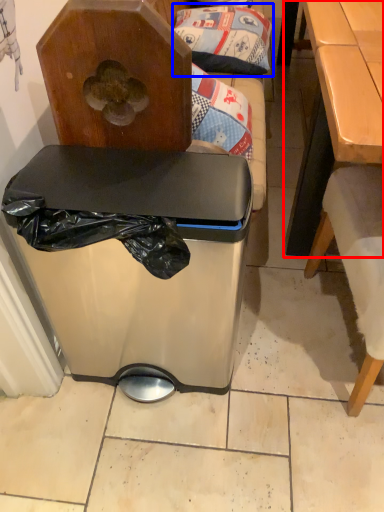
Question: Which object appears closest to the camera in this image, table (highlighted by a red box) or pillow (highlighted by a blue box)?

Choices:
 (A) table
 (B) pillow

Answer: (A)